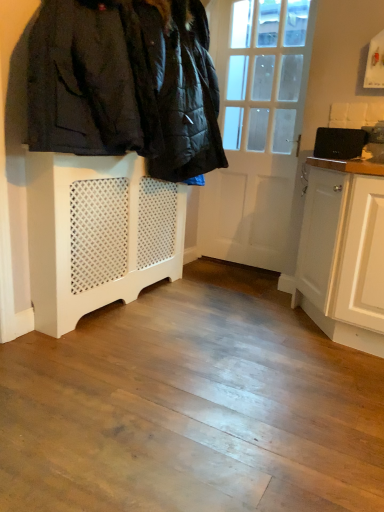
Image resolution: width=384 pixels, height=512 pixels. Find the location of `white lattice radiator at left`. white lattice radiator at left is located at coordinates (126, 84).

What is the approximate height of white painted wood radiator at lower left?

white painted wood radiator at lower left is 32.25 inches tall.

Where is `white painted wood radiator at lower left`? white painted wood radiator at lower left is located at coordinates (97, 234).

Describe the element at coordinates (256, 127) in the screenshot. I see `white wooden door at center` at that location.

What do you see at coordinates (339, 143) in the screenshot? Image resolution: width=384 pixels, height=512 pixels. I see `black matte laptop at upper right` at bounding box center [339, 143].

This screenshot has width=384, height=512. Identify the location of white lattice radiator at left. (126, 84).

Does white lattice radiator at left have a greater height compared to white wooden door at center?

Incorrect, the height of white lattice radiator at left is not larger of that of white wooden door at center.

Between white lattice radiator at left and white wooden door at center, which one has smaller width?

white wooden door at center.

From a real-world perspective, is white lattice radiator at left over white wooden door at center?

Yes.

Is point (42, 88) closer to camera compared to point (259, 138)?

Yes, point (42, 88) is in front of point (259, 138).

Is black matte laptop at upper right touching white painted wood radiator at lower left?

No.

In the scene shown: From a real-world perspective, which is physically below, black matte laptop at upper right or white painted wood radiator at lower left?

white painted wood radiator at lower left.

From the picture: Is black matte laptop at upper right bigger than white painted wood radiator at lower left?

Incorrect, black matte laptop at upper right is not larger than white painted wood radiator at lower left.

Identify the location of appliance located above the white painted wood radiator at lower left (from the image's perspective). The image size is (384, 512). (339, 143).

How different are the orientations of white painted wood radiator at lower left and white lattice radiator at left in degrees?

They differ by 0.00287 degrees in their facing directions.

Is point (179, 268) farther from viewer compared to point (30, 35)?

That is True.

Is white painted wood radiator at lower left to the left or to the right of white lattice radiator at left in the image?

From the image, it's evident that white painted wood radiator at lower left is to the left of white lattice radiator at left.

Which object is wider, white painted wood radiator at lower left or white lattice radiator at left?

Wider between the two is white lattice radiator at left.

From the image's perspective, between white wooden door at center and white painted wood radiator at lower left, which one is located above?

white wooden door at center, from the image's perspective.

How many degrees apart are the facing directions of white wooden door at center and white painted wood radiator at lower left?

The angular difference between white wooden door at center and white painted wood radiator at lower left is 90 degrees.

Is white painted wood radiator at lower left a part of white wooden door at center?

No, white painted wood radiator at lower left is located outside of white wooden door at center.

Is there a large distance between white wooden door at center and white painted wood radiator at lower left?

white wooden door at center is positioned a significant distance from white painted wood radiator at lower left.

Can you confirm if white painted wood radiator at lower left is positioned to the left of white wooden door at center?

Indeed, white painted wood radiator at lower left is positioned on the left side of white wooden door at center.

In order to click on cabinetry lying in front of the white wooden door at center in this screenshot , I will do `click(97, 234)`.

Who is taller, white painted wood radiator at lower left or white wooden door at center?

With more height is white wooden door at center.

Consider the image. From a real-world perspective, is white painted wood radiator at lower left physically located above or below white wooden door at center?

white painted wood radiator at lower left is situated lower than white wooden door at center in the real world.

Which of these two, black matte laptop at upper right or white lattice radiator at left, is thinner?

With smaller width is black matte laptop at upper right.

Between black matte laptop at upper right and white lattice radiator at left, which one has less height?

black matte laptop at upper right.

Is black matte laptop at upper right positioned beyond the bounds of white lattice radiator at left?

black matte laptop at upper right is positioned outside white lattice radiator at left.

Is white lattice radiator at left aimed at white painted wood radiator at lower left?

No, white lattice radiator at left does not turn towards white painted wood radiator at lower left.

Are white lattice radiator at left and white painted wood radiator at lower left making contact?

No, white lattice radiator at left is not making contact with white painted wood radiator at lower left.

Based on the photo, between white lattice radiator at left and white painted wood radiator at lower left, which one is positioned in front?

white lattice radiator at left.

Can you confirm if white lattice radiator at left is smaller than white painted wood radiator at lower left?

Actually, white lattice radiator at left might be larger than white painted wood radiator at lower left.

Find the location of a particular element. The image size is (384, 512). door behind the white lattice radiator at left is located at coordinates (256, 127).

Identify the location of appliance lying on the right of white painted wood radiator at lower left. This screenshot has height=512, width=384. (339, 143).

From the image, which object appears to be farther from white painted wood radiator at lower left, white wooden door at center or black matte laptop at upper right?

black matte laptop at upper right lies further to white painted wood radiator at lower left than the other object.

Considering their positions, is black matte laptop at upper right positioned closer to white lattice radiator at left than white painted wood radiator at lower left?

Among the two, white painted wood radiator at lower left is located nearer to white lattice radiator at left.

Considering their positions, is white wooden door at center positioned closer to white lattice radiator at left than black matte laptop at upper right?

Among the two, white wooden door at center is located nearer to white lattice radiator at left.

Looking at this image, considering their positions, is black matte laptop at upper right positioned further to white wooden door at center than white lattice radiator at left?

white lattice radiator at left is positioned further to the anchor white wooden door at center.

When comparing their distances from white lattice radiator at left, does white painted wood radiator at lower left or white wooden door at center seem further?

Based on the image, white wooden door at center appears to be further to white lattice radiator at left.

Considering their positions, is white painted wood radiator at lower left positioned closer to white wooden door at center than black matte laptop at upper right?

black matte laptop at upper right is positioned closer to the anchor white wooden door at center.

Estimate the real-world distances between objects in this image. Which object is further from black matte laptop at upper right, white lattice radiator at left or white wooden door at center?

The object further to black matte laptop at upper right is white lattice radiator at left.

Which object lies nearer to the anchor point black matte laptop at upper right, white wooden door at center or white lattice radiator at left?

white wooden door at center.

At what (x,y) coordinates should I click in order to perform the action: click on cabinetry between white lattice radiator at left and white wooden door at center along the z-axis. Please return your answer as a coordinate pair (x, y). Looking at the image, I should click on (97, 234).

The height and width of the screenshot is (512, 384). In order to click on furniture between white painted wood radiator at lower left and black matte laptop at upper right from left to right in this screenshot , I will do (126, 84).

Locate an element on the screen. appliance between white lattice radiator at left and white wooden door at center in the front-back direction is located at coordinates tap(339, 143).

Identify the location of door located between white painted wood radiator at lower left and black matte laptop at upper right in the left-right direction. The width and height of the screenshot is (384, 512). (256, 127).